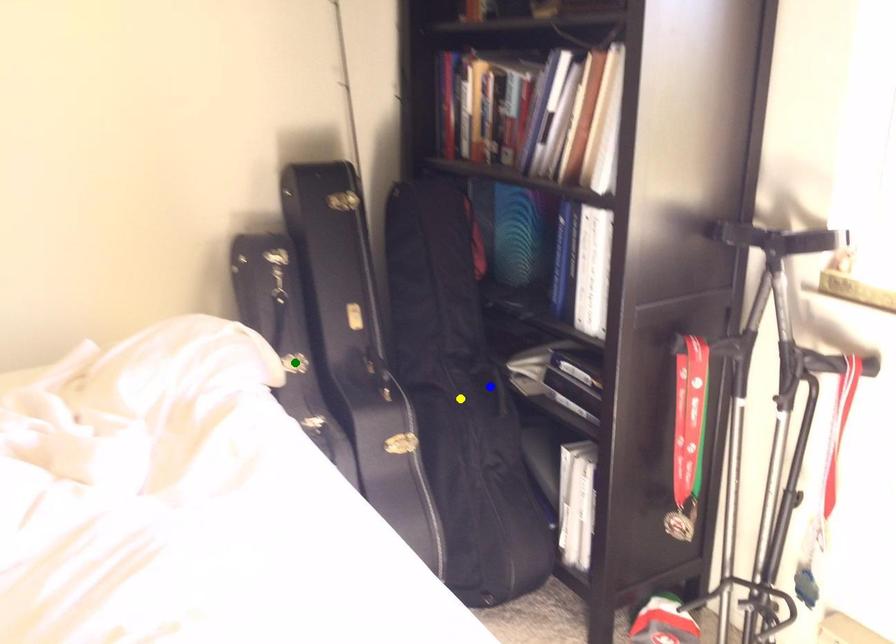
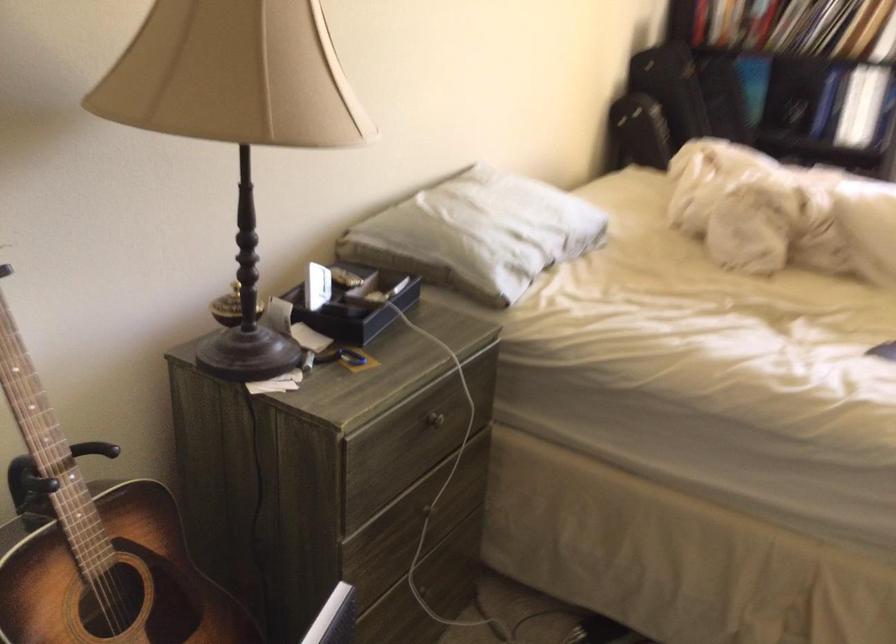
I am providing you with two images of the same scene from different viewpoints. Three points are marked in image1. Which point corresponds to a part or object that is occluded in image2?In image1, three points are marked. Which of them correspond to a part or object that is occluded in image2?Among the three points shown in image1, which one corresponds to a part or object that is no longer visible due to occlusion in image2?

green point, yellow point, blue point cannot be seen in image2.